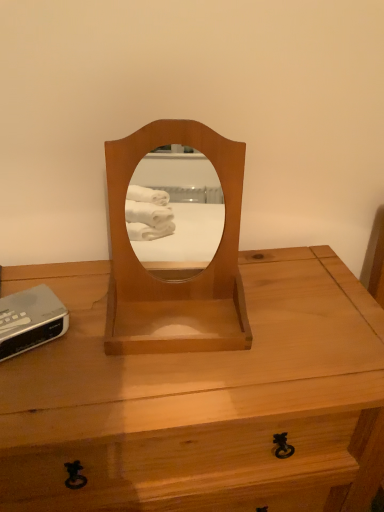
Locate an element on the screen. light brown wood mirror at center is located at coordinates (175, 279).

Between light brown wood mirror at center and silver plastic clock at lower left, which one appears on the right side from the viewer's perspective?

light brown wood mirror at center.

Does light brown wood mirror at center have a greater height compared to silver plastic clock at lower left?

Indeed, light brown wood mirror at center has a greater height compared to silver plastic clock at lower left.

Which object is closer to the camera taking this photo, light brown wood mirror at center or silver plastic clock at lower left?

light brown wood mirror at center.

Is point (233, 308) positioned behind point (345, 362)?

That is True.

Are light brown wood mirror at center and light brown wood desk at center located far from each other?

That's not correct — light brown wood mirror at center is a little close to light brown wood desk at center.

The width and height of the screenshot is (384, 512). Find the location of `desk in front of the light brown wood mirror at center`. desk in front of the light brown wood mirror at center is located at coordinates (202, 401).

The height and width of the screenshot is (512, 384). I want to click on desk to the left of light brown wood mirror at center, so click(202, 401).

In the image, is light brown wood desk at center on the left side or the right side of light brown wood mirror at center?

From the image, it's evident that light brown wood desk at center is to the left of light brown wood mirror at center.

From a real-world perspective, which object rests below the other?

light brown wood desk at center is physically lower.

Is light brown wood desk at center directly adjacent to light brown wood mirror at center?

light brown wood desk at center and light brown wood mirror at center are not in contact.

How many degrees apart are the facing directions of silver plastic clock at lower left and light brown wood mirror at center?

The facing directions of silver plastic clock at lower left and light brown wood mirror at center are 31.3 degrees apart.

This screenshot has width=384, height=512. What are the coordinates of `mirror lying on the right of silver plastic clock at lower left` in the screenshot? It's located at (175, 279).

Does silver plastic clock at lower left have a lesser width compared to light brown wood mirror at center?

Yes, silver plastic clock at lower left is thinner than light brown wood mirror at center.

From the image's perspective, between silver plastic clock at lower left and light brown wood mirror at center, which one is located above?

light brown wood mirror at center.

From the picture: From the image's perspective, is silver plastic clock at lower left below light brown wood desk at center?

No.

Considering the sizes of objects silver plastic clock at lower left and light brown wood desk at center in the image provided, who is thinner, silver plastic clock at lower left or light brown wood desk at center?

Thinner between the two is silver plastic clock at lower left.

From a real-world perspective, is silver plastic clock at lower left beneath light brown wood desk at center?

Actually, silver plastic clock at lower left is physically above light brown wood desk at center in the real world.

Between point (18, 308) and point (268, 252), which one is positioned behind?

The point (268, 252) is more distant.

Which of these two, light brown wood desk at center or silver plastic clock at lower left, stands shorter?

Standing shorter between the two is silver plastic clock at lower left.

Is light brown wood desk at center oriented towards silver plastic clock at lower left?

No, light brown wood desk at center is not oriented towards silver plastic clock at lower left.

Can you confirm if light brown wood desk at center is positioned to the right of silver plastic clock at lower left?

Yes, light brown wood desk at center is to the right of silver plastic clock at lower left.

What are the coordinates of `gadget located on the left of light brown wood mirror at center` in the screenshot? It's located at (30, 320).

Image resolution: width=384 pixels, height=512 pixels. Identify the location of desk in front of the light brown wood mirror at center. (202, 401).

Which object lies nearer to the anchor point light brown wood mirror at center, light brown wood desk at center or silver plastic clock at lower left?

The object closer to light brown wood mirror at center is light brown wood desk at center.

When comparing their distances from light brown wood desk at center, does silver plastic clock at lower left or light brown wood mirror at center seem further?

Among the two, silver plastic clock at lower left is located further to light brown wood desk at center.

When comparing their distances from light brown wood desk at center, does light brown wood mirror at center or silver plastic clock at lower left seem further?

silver plastic clock at lower left is further to light brown wood desk at center.

Based on their spatial positions, is silver plastic clock at lower left or light brown wood desk at center further from light brown wood mirror at center?

silver plastic clock at lower left.

When comparing their distances from silver plastic clock at lower left, does light brown wood desk at center or light brown wood mirror at center seem further?

light brown wood desk at center lies further to silver plastic clock at lower left than the other object.

Which object lies nearer to the anchor point silver plastic clock at lower left, light brown wood mirror at center or light brown wood desk at center?

light brown wood mirror at center.

Where is `gadget between light brown wood mirror at center and light brown wood desk at center in the up-down direction`? The height and width of the screenshot is (512, 384). gadget between light brown wood mirror at center and light brown wood desk at center in the up-down direction is located at coordinates (30, 320).